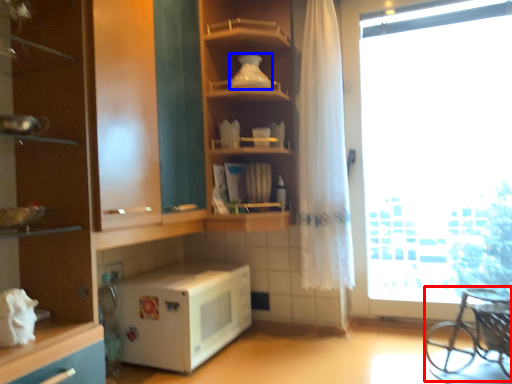
Question: Which object appears farthest to the camera in this image, baby carriage (highlighted by a red box) or appliance (highlighted by a blue box)?

Choices:
 (A) baby carriage
 (B) appliance

Answer: (B)